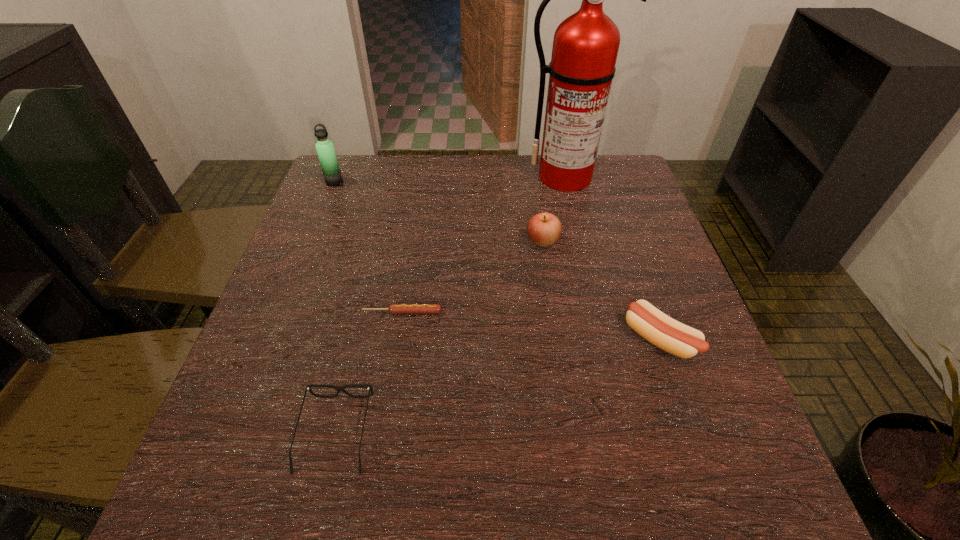
Locate an element on the screen. This screenshot has height=540, width=960. the left sausage is located at coordinates (393, 308).

The height and width of the screenshot is (540, 960). Identify the location of free space located 0.390m at the nozzle of the tallest object. (593, 300).

Where is `vacant region located 0.230m on the right of the leftmost object`? The width and height of the screenshot is (960, 540). vacant region located 0.230m on the right of the leftmost object is located at coordinates (424, 182).

Identify the location of vacant position located on the back of the apple. The width and height of the screenshot is (960, 540). (531, 163).

Find the location of a particular element. free space located on the left of the taller sausage is located at coordinates (478, 339).

Where is `vacant space located 0.050m on the right of the shorter sausage`? This screenshot has height=540, width=960. vacant space located 0.050m on the right of the shorter sausage is located at coordinates click(x=467, y=312).

Identify the location of fire extinguisher located in the far edge section of the desktop. (585, 46).

This screenshot has width=960, height=540. Identify the location of thermos bottle located in the far edge section of the desktop. (325, 149).

Find the location of a particular element. The image size is (960, 540). object that is at the near edge is located at coordinates (308, 387).

Locate an element on the screen. The width and height of the screenshot is (960, 540). thermos bottle that is at the left edge is located at coordinates coord(325,149).